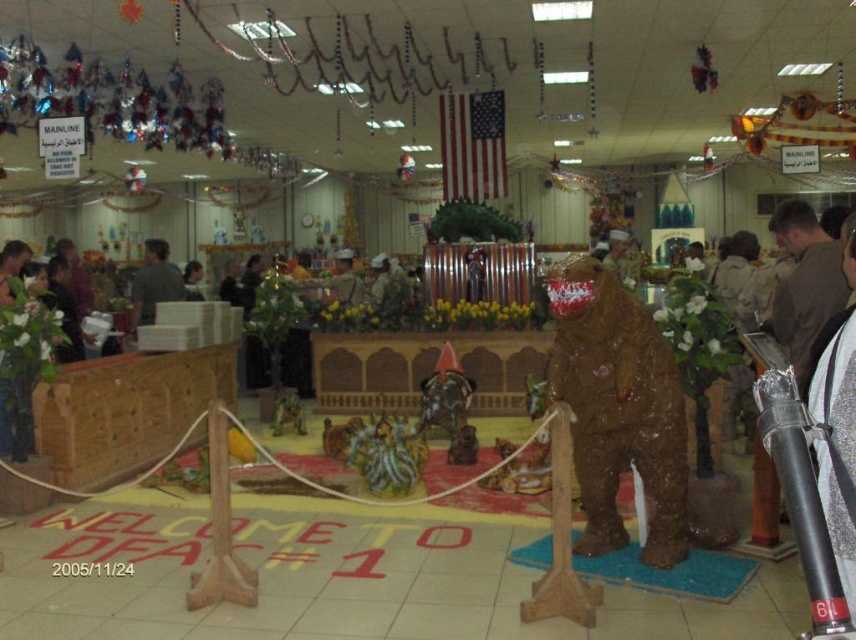
You are standing at point (x=348, y=252) and want to move to the American flag near the back wall. There is a large bear sculpture at point (x=180, y=288). Which direction should you move relative to the bear sculpture to reach the flag?

You should move behind the large bear sculpture at point (x=180, y=288) because point (x=180, y=288) is in front of point (x=348, y=252), meaning the flag is behind the bear sculpture.

You are organizing a photo shoot and need to ensure that the gray fabric shirt at center and the matte brown bear at center are both visible in the frame. Based on their sizes, which object should you prioritize positioning closer to the camera to ensure visibility?

The gray fabric shirt at center might be wider than matte brown bear at center, so you should prioritize positioning the matte brown bear at center closer to the camera to ensure it is visible.

You are a photographer at the event and want to capture a photo of both the gray fabric shirt at center and the matte brown bear at center. Which object should you focus on first if you want to ensure both are in frame without moving the camera?

You should focus on the gray fabric shirt at center first because it is taller than the matte brown bear at center, ensuring it fits within the frame while the bear remains in view.